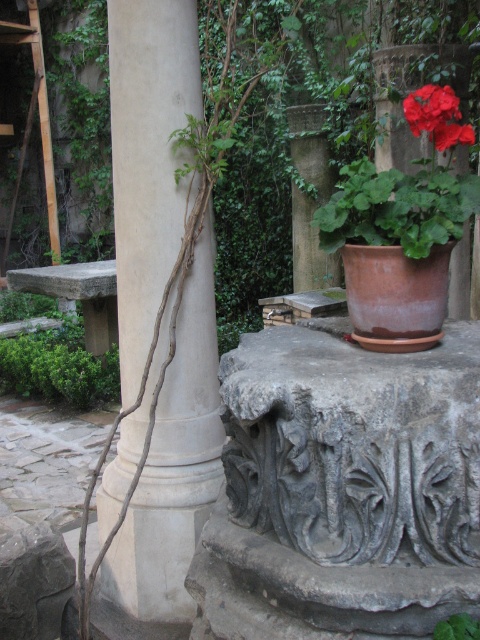
Question: Among these objects, which one is nearest to the camera?

Choices:
 (A) vivid red petals at upper right
 (B) white stone column at center
 (C) green leafy plant at center

Answer: (C)

Question: Does white stone column at center have a larger size compared to green leafy plant at center?

Choices:
 (A) no
 (B) yes

Answer: (B)

Question: Considering the real-world distances, which object is farthest from the green leafy plant at center?

Choices:
 (A) vivid red petals at upper right
 (B) white stone column at center

Answer: (B)

Question: Which point appears closest to the camera in this image?

Choices:
 (A) (428, 115)
 (B) (434, 627)
 (C) (172, 552)

Answer: (B)

Question: Can you confirm if vivid red petals at upper right is positioned above green leafy plant at center?

Choices:
 (A) yes
 (B) no

Answer: (A)

Question: Is the position of white stone column at center more distant than that of vivid red petals at upper right?

Choices:
 (A) yes
 (B) no

Answer: (A)